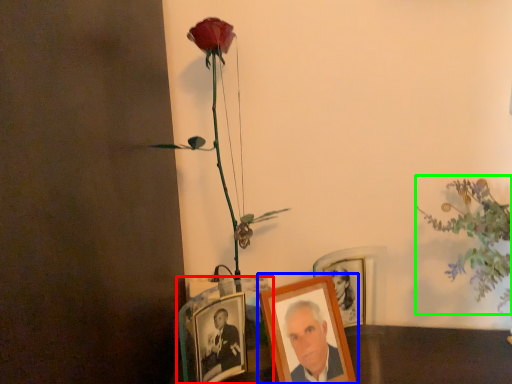
Question: Estimate the real-world distances between objects in this image. Which object is closer to picture frame (highlighted by a red box), picture frame (highlighted by a blue box) or floral arrangement (highlighted by a green box)?

Choices:
 (A) picture frame
 (B) floral arrangement

Answer: (A)